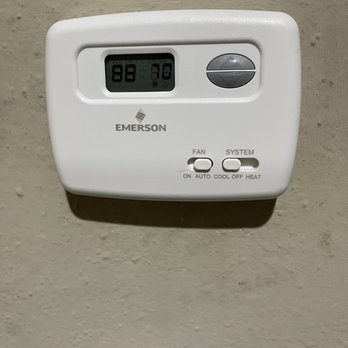
The width and height of the screenshot is (348, 348). I want to click on word 'fan', so click(x=197, y=153).